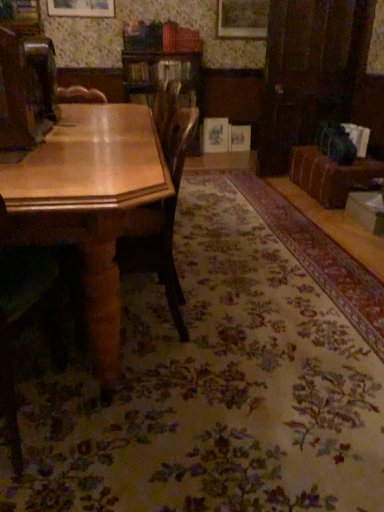
Where is `free space behind wooden chair at center, marked as the 1th chair in a right-to-left arrangement`? free space behind wooden chair at center, marked as the 1th chair in a right-to-left arrangement is located at coordinates (178, 281).